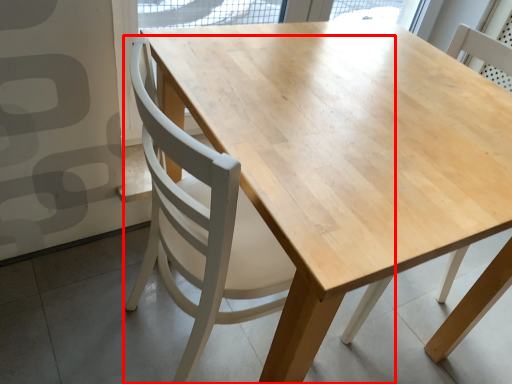
Question: From the image's perspective, what is the correct spatial relationship of chair (annotated by the red box) in relation to chair?

Choices:
 (A) above
 (B) below

Answer: (B)